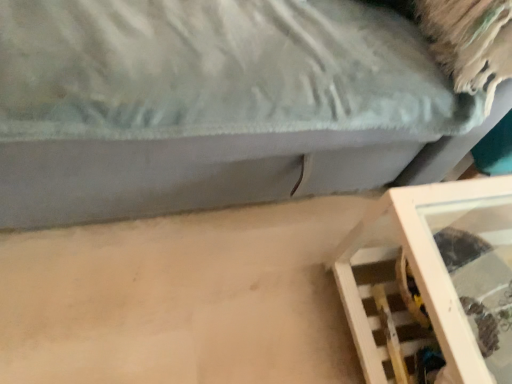
Question: Is wooden frame at lower right, the second furniture in the bottom-to-top sequence, to the left or to the right of wooden shelf at lower right, the 2th furniture from the top, in the image?

Choices:
 (A) left
 (B) right

Answer: (A)

Question: Choose the correct answer: Is wooden frame at lower right, which appears as the 1th furniture when viewed from the top, inside wooden shelf at lower right, the 2th furniture from the top, or outside it?

Choices:
 (A) inside
 (B) outside

Answer: (B)

Question: Considering the positions of point (233, 112) and point (439, 314), is point (233, 112) closer or farther from the camera than point (439, 314)?

Choices:
 (A) closer
 (B) farther

Answer: (B)

Question: Based on their sizes in the image, would you say wooden shelf at lower right, the 2th furniture from the top, is bigger or smaller than wooden frame at lower right, which appears as the 1th furniture when viewed from the top?

Choices:
 (A) small
 (B) big

Answer: (A)

Question: Would you say wooden shelf at lower right, which is the first furniture from bottom to top, is to the left or to the right of wooden frame at lower right, which appears as the 1th furniture when viewed from the top, in the picture?

Choices:
 (A) right
 (B) left

Answer: (A)

Question: From their relative heights in the image, would you say wooden shelf at lower right, the 2th furniture from the top, is taller or shorter than wooden frame at lower right, which appears as the 1th furniture when viewed from the top?

Choices:
 (A) tall
 (B) short

Answer: (B)

Question: Looking at their shapes, would you say wooden shelf at lower right, the 2th furniture from the top, is wider or thinner than wooden frame at lower right, the second furniture in the bottom-to-top sequence?

Choices:
 (A) wide
 (B) thin

Answer: (B)